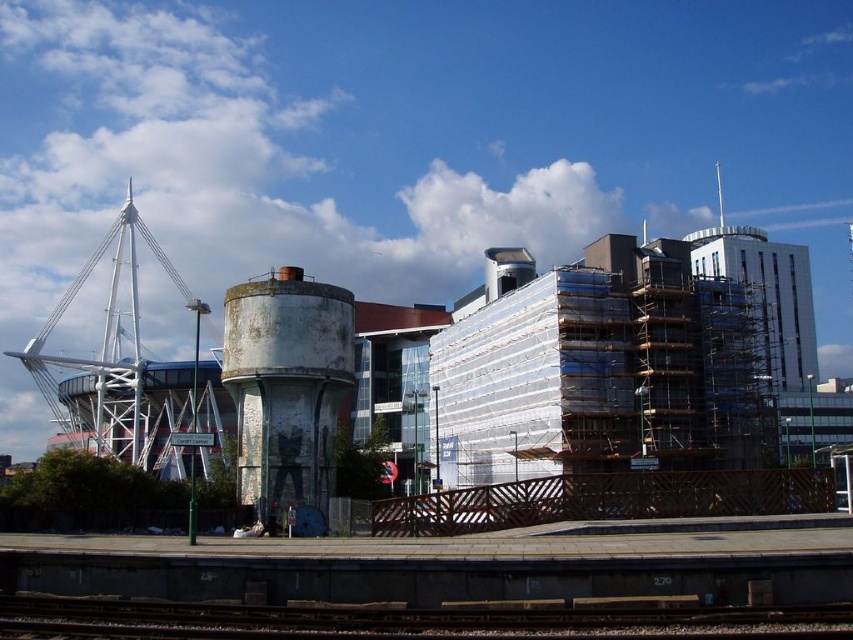
Can you confirm if white concrete water tower at center-left is smaller than white metallic structure at left?

Yes, white concrete water tower at center-left is smaller than white metallic structure at left.

Based on the photo, can you confirm if white concrete water tower at center-left is positioned below white metallic structure at left?

Correct, white concrete water tower at center-left is located below white metallic structure at left.

Who is more distant from viewer, [238,356] or [38,339]?

Point [38,339]

The image size is (853, 640). I want to click on white concrete water tower at center-left, so click(287, 390).

Does white concrete water tower at center-left appear under metal at bottom?

No.

Does white concrete water tower at center-left have a larger size compared to metal at bottom?

Indeed, white concrete water tower at center-left has a larger size compared to metal at bottom.

Is point (252, 333) behind point (175, 604)?

Yes, point (252, 333) is farther from viewer.

Where is `white concrete water tower at center-left`? Image resolution: width=853 pixels, height=640 pixels. white concrete water tower at center-left is located at coordinates (287, 390).

Is metal at bottom bigger than white metallic structure at left?

Actually, metal at bottom might be smaller than white metallic structure at left.

Is metal at bottom positioned at the back of white metallic structure at left?

No.

Which is behind, point (368, 632) or point (90, 378)?

The point (90, 378) is more distant.

The image size is (853, 640). Find the location of `metal at bottom`. metal at bottom is located at coordinates (403, 620).